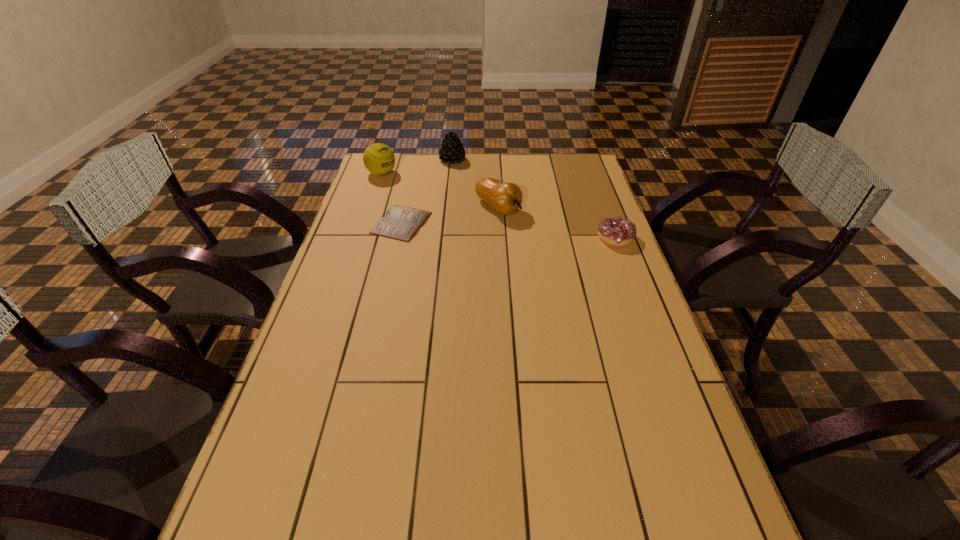
Where is `free location that satisfies the following two spatial constraints: 1. on the front side of the doughnut; 2. on the right side of the pinecone`? This screenshot has width=960, height=540. free location that satisfies the following two spatial constraints: 1. on the front side of the doughnut; 2. on the right side of the pinecone is located at coordinates (444, 238).

The height and width of the screenshot is (540, 960). What are the coordinates of `free space that satisfies the following two spatial constraints: 1. on the front side of the pinecone; 2. on the right side of the fourth object from left to right` in the screenshot? It's located at (448, 207).

Identify the location of free space that satisfies the following two spatial constraints: 1. on the back side of the softball; 2. on the left side of the pinecone. (386, 160).